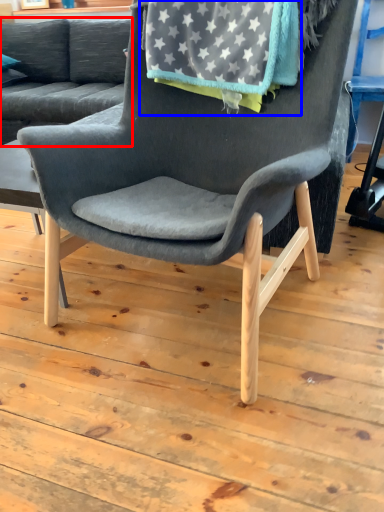
Question: Which object is closer to the camera taking this photo, studio couch (highlighted by a red box) or blanket (highlighted by a blue box)?

Choices:
 (A) studio couch
 (B) blanket

Answer: (B)